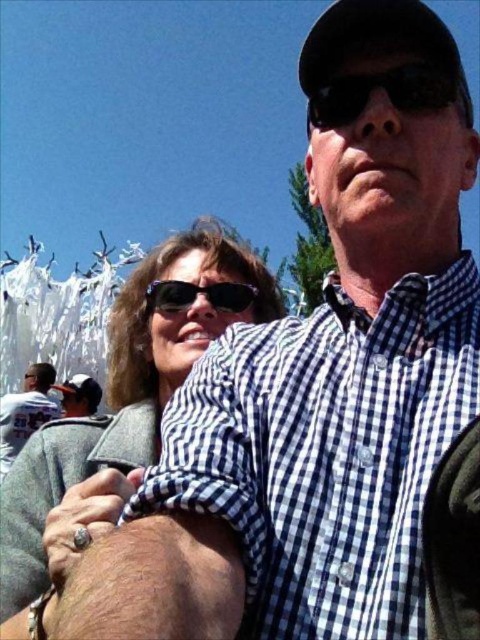
Is checkered fabric shirt at center closer to the viewer compared to matte black sunglasses at upper center?

Yes, it is.

Is point (358, 413) farther from camera compared to point (50, 570)?

That is True.

Which is in front, point (264, 492) or point (28, 604)?

Positioned in front is point (264, 492).

At what (x,y) coordinates should I click in order to perform the action: click on checkered fabric shirt at center. Please return your answer as a coordinate pair (x, y). Image resolution: width=480 pixels, height=640 pixels. Looking at the image, I should click on (326, 452).

In the scene shown: Is matte black sunglasses at upper center taller than matte black cap at upper left?

Yes.

Where is `matte black sunglasses at upper center`? matte black sunglasses at upper center is located at coordinates (118, 412).

Which is in front, point (156, 360) or point (72, 394)?

Point (156, 360)

Where is `matte black sunglasses at upper center`? The image size is (480, 640). matte black sunglasses at upper center is located at coordinates (118, 412).

Does black reflective sunglasses at upper center have a lesser width compared to black reflective sunglasses at center?

Incorrect, black reflective sunglasses at upper center's width is not less than black reflective sunglasses at center's.

Does point (339, 80) come in front of point (244, 307)?

That is True.

Locate an element on the screen. black reflective sunglasses at upper center is located at coordinates pyautogui.click(x=385, y=92).